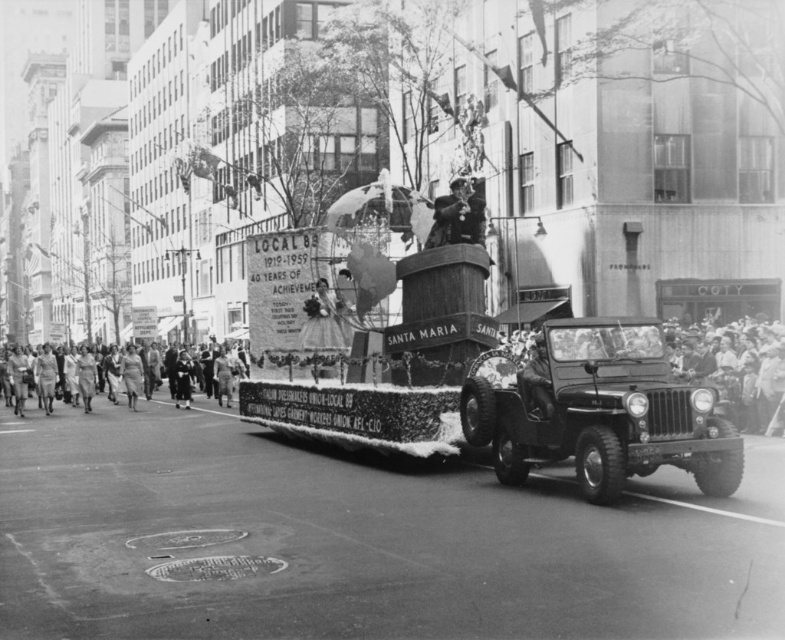
You are a photographer at the vintage parade scene. You need to capture a photo of both the smooth fabric dress at center and the leather jacket at center. Since you want to ensure both are fully visible in the frame, which object should you position closer to the camera to avoid cropping?

The smooth fabric dress at center is wider than the leather jacket at center. To ensure both are fully visible, position the smooth fabric dress at center closer to the camera since its greater width requires more space in the frame.

You are a photographer positioned at the front of the parade route. You want to capture a clear photo of both the smooth leather hat at center and the smooth black suit at center. Which object should you adjust your focus to first to ensure it appears sharp in the foreground?

The smooth leather hat at center should be focused on first because it is in front of the smooth black suit at center, which is behind it. Focusing on the closer object ensures it remains sharp while the background may blur slightly.

Consider the image. You are a photographer at the vintage parade scene. You need to capture a photo where both the smooth fabric dress at center and the leather jacket at center are visible. Which one will appear taller in the photo?

The smooth fabric dress at center will appear taller in the photo since it has a greater height compared to the leather jacket at center.